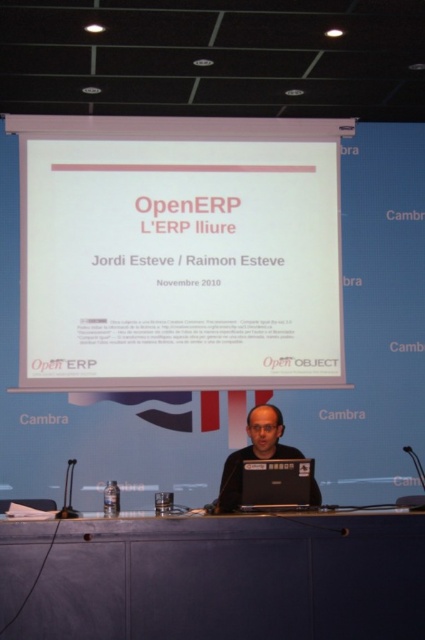
You are a speaker who just finished your presentation. You need to place a 2.0 meters long ribbon from the white paper at center to the matte black laptop at center. Can you fit the ribbon between them without bending it?

The distance between the white paper at center and the matte black laptop at center is 1.90 meters. Since the ribbon is 2.0 meters long, it is slightly longer than the distance. Therefore, the ribbon cannot be placed straight between them without bending.

You are attending a presentation and need to place a small notebook on the table. Given that the dark gray matte table at center is below the black glossy laptop at center, where should you place the notebook to ensure it is visible to the audience?

Since the dark gray matte table at center is located below the black glossy laptop at center, placing the notebook on the dark gray matte table at center would ensure it is visible to the audience as it is positioned lower than the laptop.